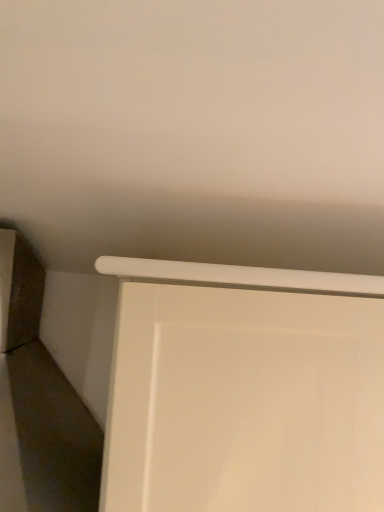
Locate an element on the screen. The image size is (384, 512). white glossy door at upper center is located at coordinates (244, 389).

What do you see at coordinates (244, 389) in the screenshot? The image size is (384, 512). I see `white glossy door at upper center` at bounding box center [244, 389].

This screenshot has width=384, height=512. Find the location of `white glossy door at upper center`. white glossy door at upper center is located at coordinates [x=244, y=389].